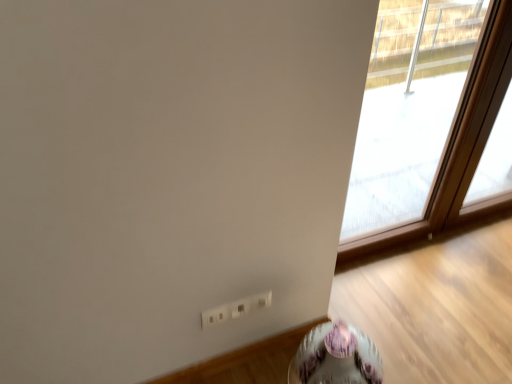
Locate an element on the screen. transparent glass window at upper right is located at coordinates (433, 143).

This screenshot has width=512, height=384. Describe the element at coordinates (433, 143) in the screenshot. I see `transparent glass window at upper right` at that location.

Locate an element on the screen. porcelain floral-patterned table at lower right is located at coordinates (339, 352).

In order to face porcelain floral-patterned table at lower right, should I rotate leftwards or rightwards?

Rotate your view right by about 10.085°.

Describe the element at coordinates (339, 352) in the screenshot. The height and width of the screenshot is (384, 512). I see `porcelain floral-patterned table at lower right` at that location.

This screenshot has width=512, height=384. What are the coordinates of `transparent glass window at upper right` in the screenshot? It's located at (433, 143).

Between porcelain floral-patterned table at lower right and transparent glass window at upper right, which one appears on the left side from the viewer's perspective?

porcelain floral-patterned table at lower right is more to the left.

Which object is closer to the camera, porcelain floral-patterned table at lower right or transparent glass window at upper right?

porcelain floral-patterned table at lower right is closer to the camera.

Is point (344, 330) farther from viewer compared to point (393, 102)?

No, (344, 330) is in front of (393, 102).

From the image's perspective, is porcelain floral-patterned table at lower right above transparent glass window at upper right?

No, from the image's perspective, porcelain floral-patterned table at lower right is not over transparent glass window at upper right.

From a real-world perspective, relative to transparent glass window at upper right, is porcelain floral-patterned table at lower right vertically above or below?

In terms of real-world spatial position, porcelain floral-patterned table at lower right is below transparent glass window at upper right.

Looking at their sizes, would you say porcelain floral-patterned table at lower right is wider or thinner than transparent glass window at upper right?

In the image, porcelain floral-patterned table at lower right appears to be wider than transparent glass window at upper right.

Considering the relative sizes of porcelain floral-patterned table at lower right and transparent glass window at upper right in the image provided, is porcelain floral-patterned table at lower right taller than transparent glass window at upper right?

In fact, porcelain floral-patterned table at lower right may be shorter than transparent glass window at upper right.

Who is smaller, porcelain floral-patterned table at lower right or transparent glass window at upper right?

Smaller between the two is porcelain floral-patterned table at lower right.

Is transparent glass window at upper right surrounded by porcelain floral-patterned table at lower right?

No, transparent glass window at upper right is located outside of porcelain floral-patterned table at lower right.

Is porcelain floral-patterned table at lower right far away from transparent glass window at upper right?

porcelain floral-patterned table at lower right is positioned a significant distance from transparent glass window at upper right.

Could you tell me if porcelain floral-patterned table at lower right is turned towards transparent glass window at upper right?

No, porcelain floral-patterned table at lower right is not turned towards transparent glass window at upper right.

I want to click on round table lying in front of the transparent glass window at upper right, so click(339, 352).

Between transparent glass window at upper right and porcelain floral-patterned table at lower right, which one appears on the left side from the viewer's perspective?

porcelain floral-patterned table at lower right is more to the left.

Which object is further away from the camera, transparent glass window at upper right or porcelain floral-patterned table at lower right?

transparent glass window at upper right is more distant.

Considering the points (493, 103) and (340, 343), which point is in front, point (493, 103) or point (340, 343)?

The point (340, 343) is closer.

From the image's perspective, would you say transparent glass window at upper right is shown under porcelain floral-patterned table at lower right?

Actually, transparent glass window at upper right appears above porcelain floral-patterned table at lower right in the image.

From a real-world perspective, is transparent glass window at upper right located beneath porcelain floral-patterned table at lower right?

No, from a real-world perspective, transparent glass window at upper right is not beneath porcelain floral-patterned table at lower right.

In terms of width, does transparent glass window at upper right look wider or thinner when compared to porcelain floral-patterned table at lower right?

transparent glass window at upper right is thinner than porcelain floral-patterned table at lower right.

Between transparent glass window at upper right and porcelain floral-patterned table at lower right, which one has less height?

With less height is porcelain floral-patterned table at lower right.

Considering the sizes of objects transparent glass window at upper right and porcelain floral-patterned table at lower right in the image provided, who is bigger, transparent glass window at upper right or porcelain floral-patterned table at lower right?

transparent glass window at upper right is bigger.

Would you say transparent glass window at upper right is outside porcelain floral-patterned table at lower right?

→ Absolutely, transparent glass window at upper right is external to porcelain floral-patterned table at lower right.

Would you consider transparent glass window at upper right to be distant from porcelain floral-patterned table at lower right?

transparent glass window at upper right is positioned a significant distance from porcelain floral-patterned table at lower right.

Could you tell me if transparent glass window at upper right is turned towards porcelain floral-patterned table at lower right?

No, transparent glass window at upper right is not aimed at porcelain floral-patterned table at lower right.

How much distance is there between transparent glass window at upper right and porcelain floral-patterned table at lower right?

transparent glass window at upper right and porcelain floral-patterned table at lower right are 4.05 feet apart from each other.

Where is `round table below the transparent glass window at upper right (from a real-world perspective)`? round table below the transparent glass window at upper right (from a real-world perspective) is located at coordinates (339, 352).

Identify the location of round table located underneath the transparent glass window at upper right (from a real-world perspective). The width and height of the screenshot is (512, 384). (339, 352).

Identify the location of window above the porcelain floral-patterned table at lower right (from a real-world perspective). The height and width of the screenshot is (384, 512). (433, 143).